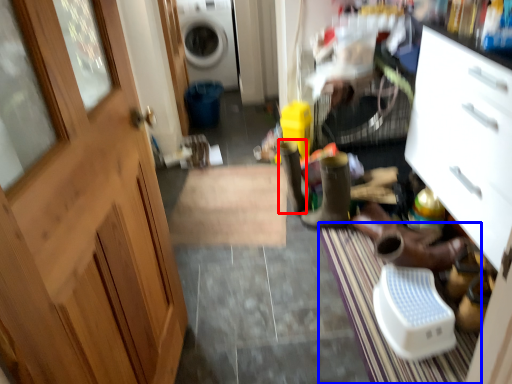
Question: Which object is closer to the camera taking this photo, boot (highlighted by a red box) or doormat (highlighted by a blue box)?

Choices:
 (A) boot
 (B) doormat

Answer: (B)